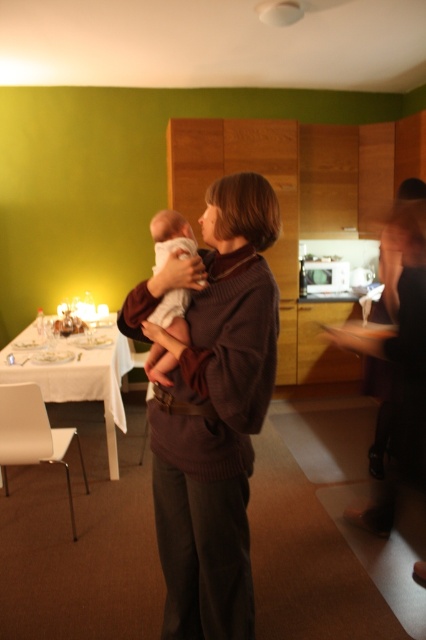
You are a parent holding the white soft baby at center and want to place it on the white cloth table at left. Can you safely place the baby on the table without needing to move more than 4 feet?

The white cloth table at left is 3.88 feet away from the white soft baby at center, so yes, you can safely place the baby on the table without needing to move more than 4 feet.

What are the coordinates of the brown sweater at center?

The coordinates of the brown sweater at center are at point [213,410].

You are standing in the dining area and need to hand a gift to the woman wearing the brown sweater at center. Based on the coordinates provided, in which direction should you move to reach her?

The brown sweater at center is located at point coordinates, so you should move towards the center area of the dining space to reach her.